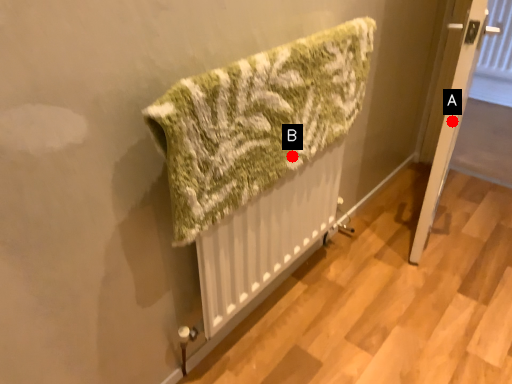
Question: Two points are circled on the image, labeled by A and B beside each circle. Which point appears closest to the camera in this image?

Choices:
 (A) A is closer
 (B) B is closer

Answer: (B)